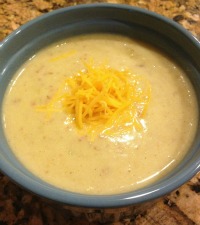
The height and width of the screenshot is (225, 200). I want to click on granite surface, so click(177, 215).